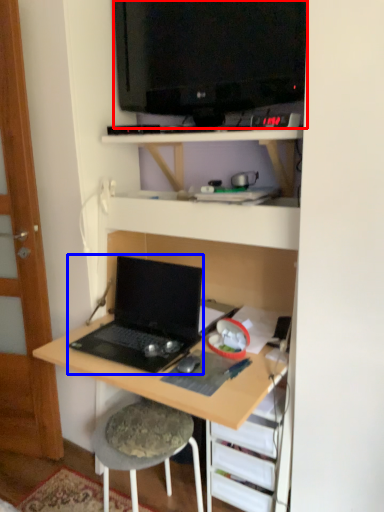
Question: Which of the following is the closest to the observer, television (highlighted by a red box) or laptop (highlighted by a blue box)?

Choices:
 (A) television
 (B) laptop

Answer: (A)